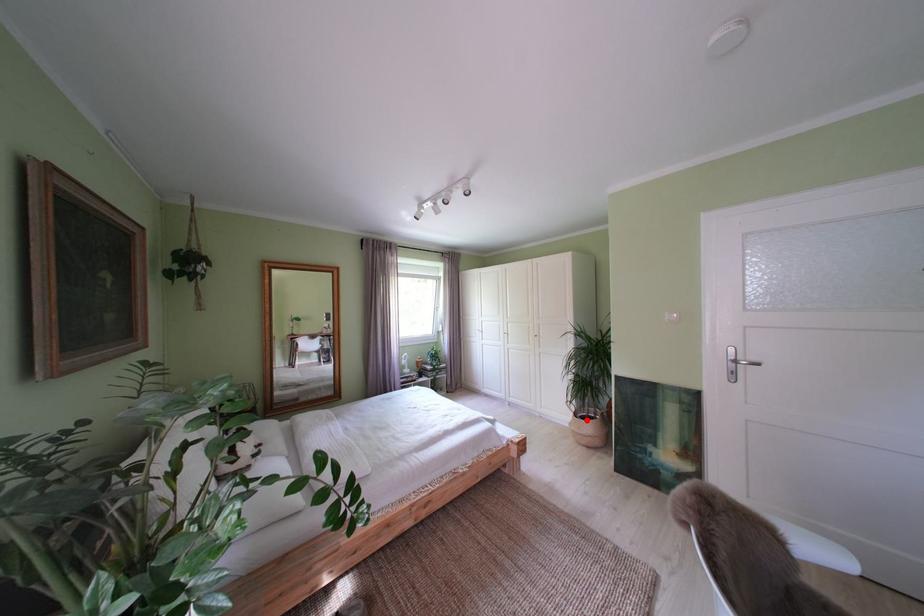
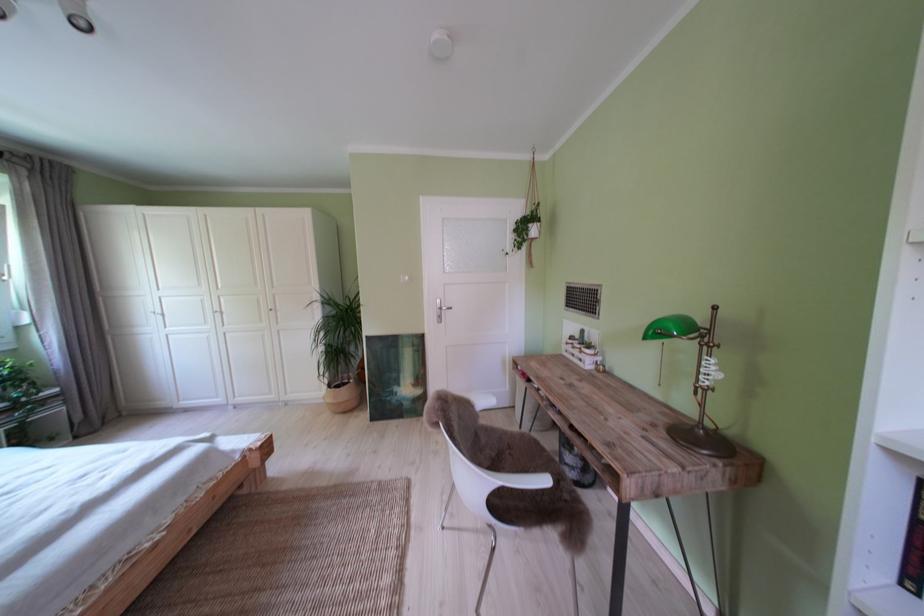
The point at the highlighted location is marked in the first image. Where is the corresponding point in the second image?

(341, 392)